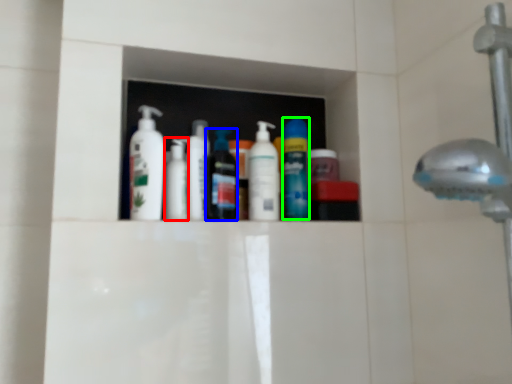
Question: Based on their relative distances, which object is nearer to toiletry (highlighted by a red box)? Choose from mouthwash (highlighted by a blue box) and mouthwash (highlighted by a green box).

Choices:
 (A) mouthwash
 (B) mouthwash

Answer: (A)